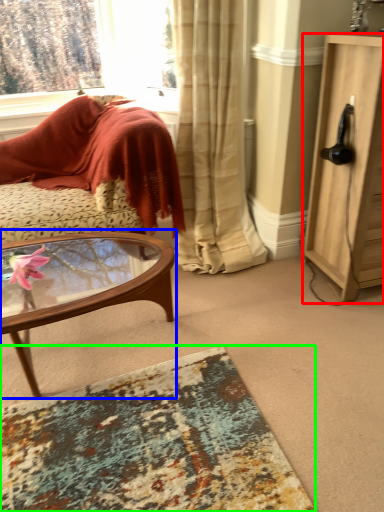
Question: Which is nearer to the cabinetry (highlighted by a red box)? coffee table (highlighted by a blue box) or desk (highlighted by a green box).

Choices:
 (A) coffee table
 (B) desk

Answer: (A)